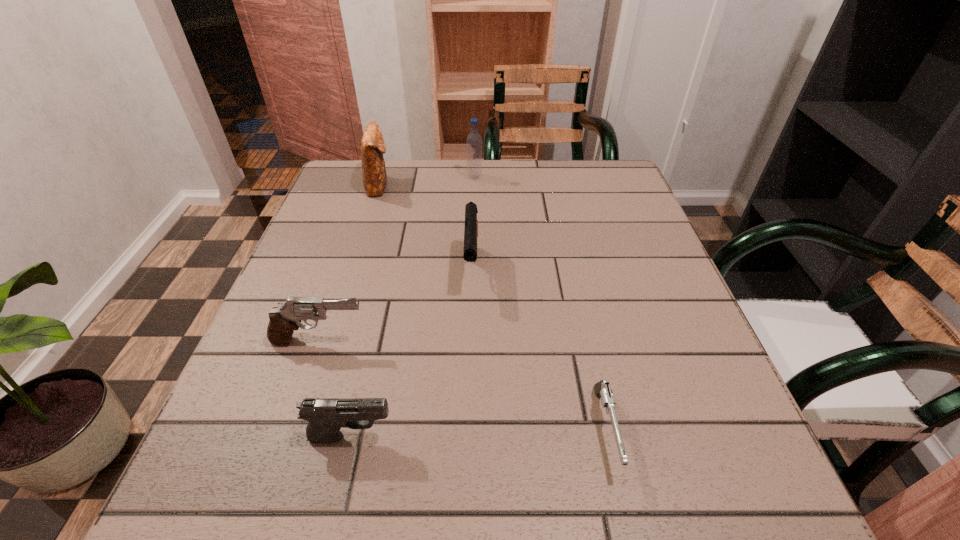
Identify the location of water bottle. This screenshot has height=540, width=960. (474, 140).

This screenshot has height=540, width=960. Find the location of `clutch bag`. clutch bag is located at coordinates (373, 147).

I want to click on the fourth nearest object, so click(x=471, y=223).

The height and width of the screenshot is (540, 960). Identify the location of the second pistol from right to left. (471, 223).

Locate an element on the screen. This screenshot has height=540, width=960. the fourth farthest object is located at coordinates (284, 320).

Where is `the third tallest pistol`? Image resolution: width=960 pixels, height=540 pixels. the third tallest pistol is located at coordinates click(x=326, y=416).

I want to click on the rightmost object, so [602, 389].

This screenshot has height=540, width=960. What are the coordinates of `the shortest pistol` in the screenshot? It's located at (602, 389).

Identify the location of vacant space situated on the left of the water bottle. (420, 178).

Identify the location of vacant space located on the open side of the clutch bag. The width and height of the screenshot is (960, 540). (521, 185).